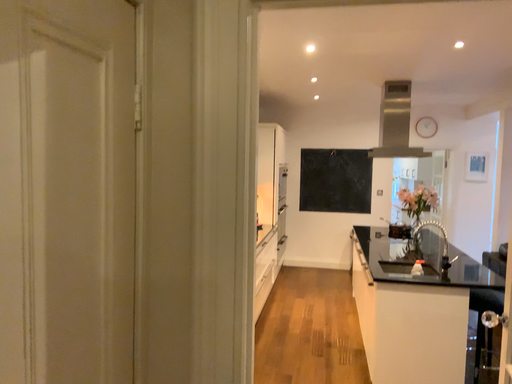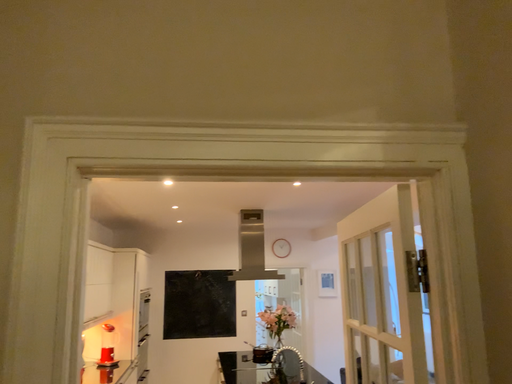
Question: Which way did the camera rotate in the video?

Choices:
 (A) rotated left
 (B) rotated right

Answer: (B)